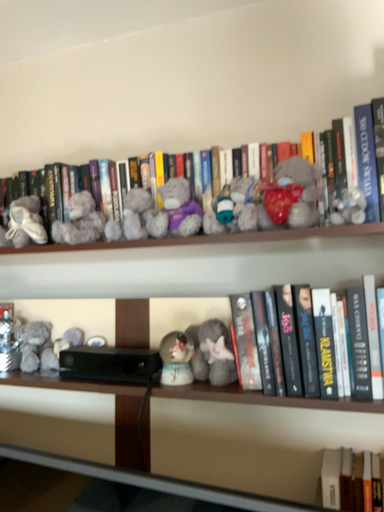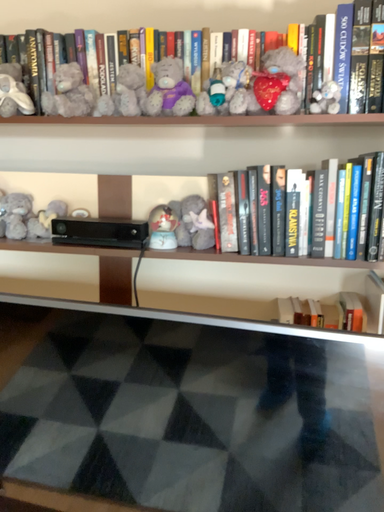
Question: How did the camera likely rotate when shooting the video?

Choices:
 (A) rotated upward
 (B) rotated downward

Answer: (B)